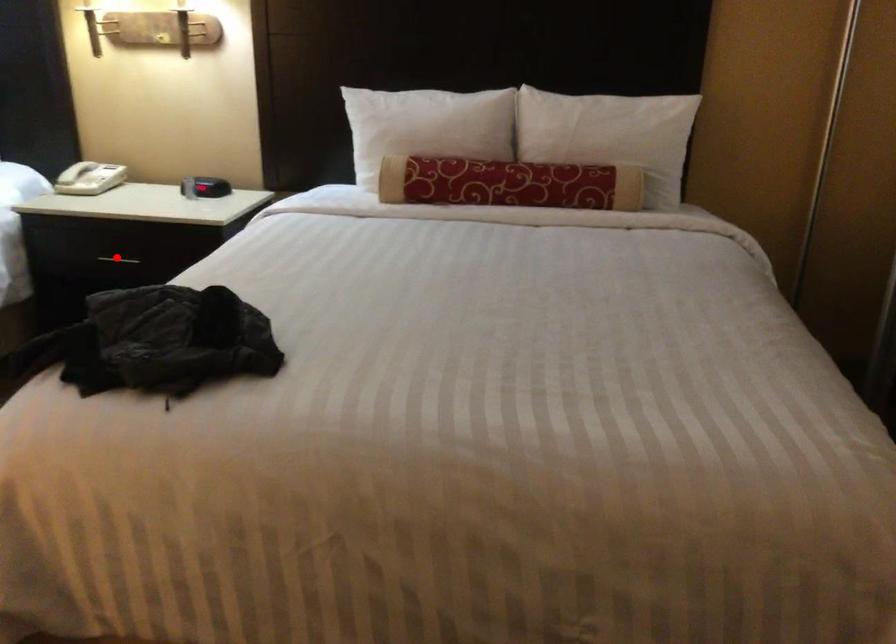
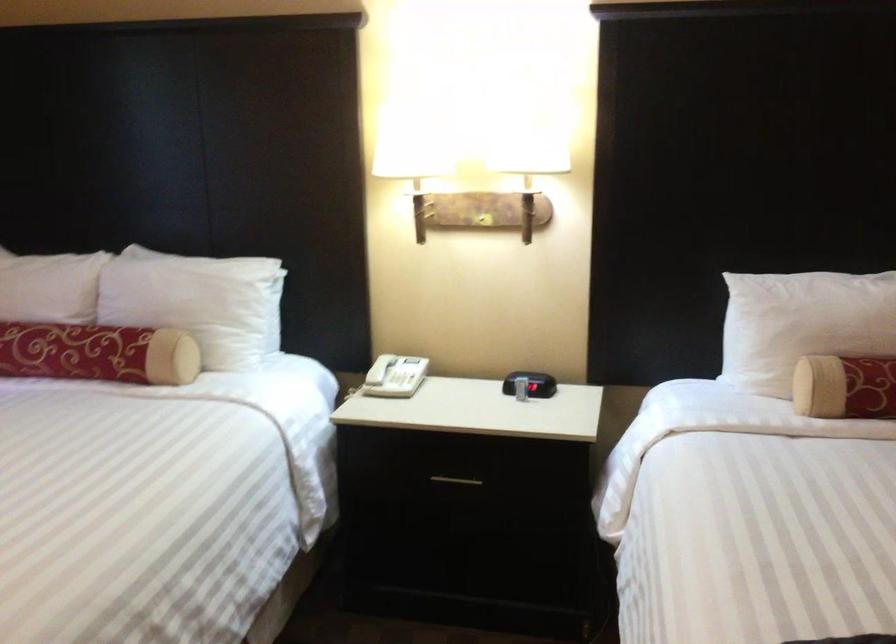
In the second image, find the point that corresponds to the highlighted location in the first image.

(455, 480)